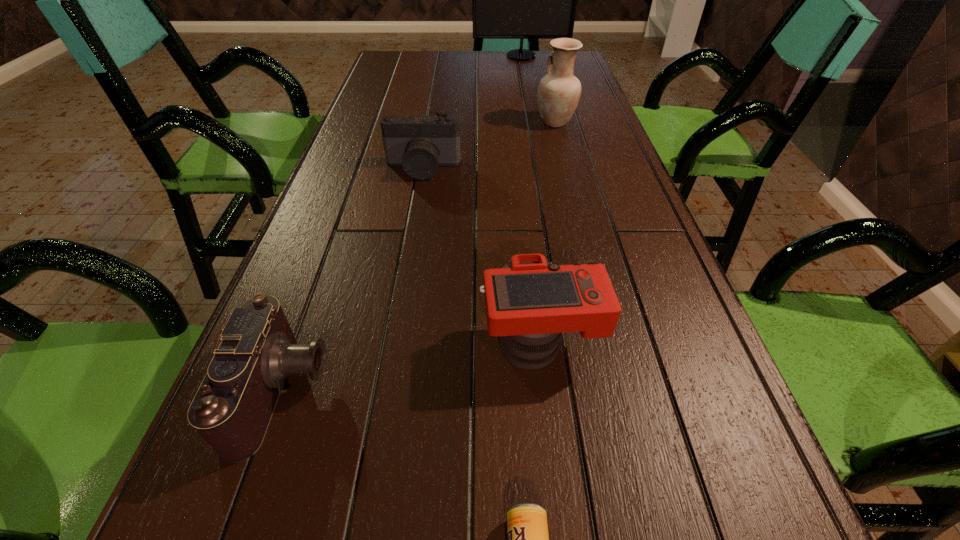
Find the location of a particular element. This screenshot has width=960, height=540. vacant area that lies between the rightmost camera and the computer monitor is located at coordinates (531, 199).

This screenshot has height=540, width=960. Find the location of `vacant area between the farthest camera and the computer monitor`. vacant area between the farthest camera and the computer monitor is located at coordinates (472, 112).

The image size is (960, 540). Find the location of `object that is the third closest to the rightmost camera`. object that is the third closest to the rightmost camera is located at coordinates click(x=419, y=144).

This screenshot has width=960, height=540. Find the location of `the closest object to the pottery`. the closest object to the pottery is located at coordinates (419, 144).

In order to click on camera that can be found as the second closest to the pottery in this screenshot , I will do `click(530, 302)`.

Image resolution: width=960 pixels, height=540 pixels. I want to click on the closest camera to the farthest camera, so click(x=530, y=302).

Locate an element on the screen. Image resolution: width=960 pixels, height=540 pixels. blank area in the image that satisfies the following two spatial constraints: 1. at the lens of the rightmost camera; 2. on the right side of the farthest camera is located at coordinates (394, 341).